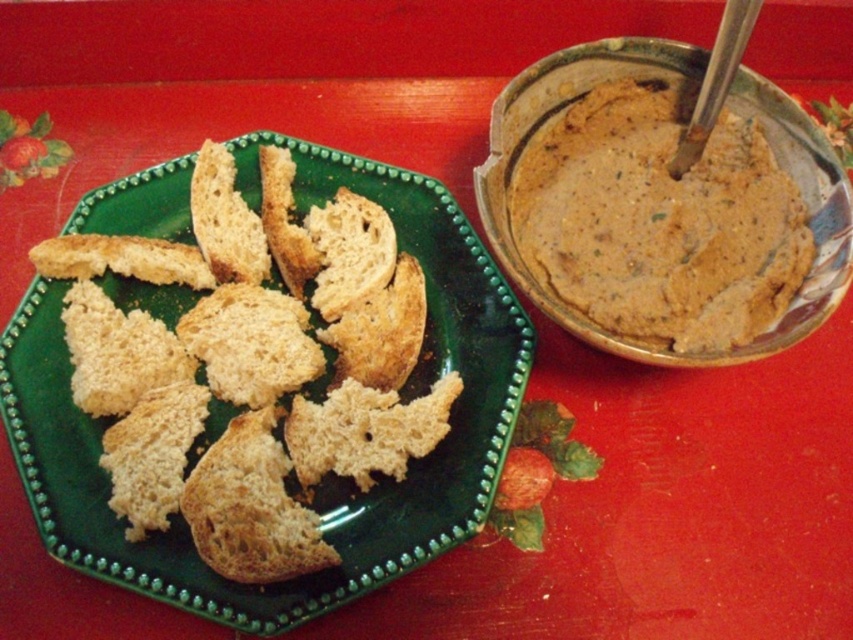
Consider the image. You are preparing to serve a snack and have both the smooth brown paste at upper right and the golden brown crumbly bread at center on the table. If you want to place the larger item in a container first, which one should you choose?

The smooth brown paste at upper right is bigger than the golden brown crumbly bread at center, so you should place the smooth brown paste at upper right in the container first.

Consider the image. You are a chef preparing a dish and need to know the distance between the smooth brown paste at upper right and the golden brown crumbly bread at center. Can you confirm if the distance is more than 18 inches?

The smooth brown paste at upper right is 19.45 inches from the golden brown crumbly bread at center, so yes, the distance is more than 18 inches.